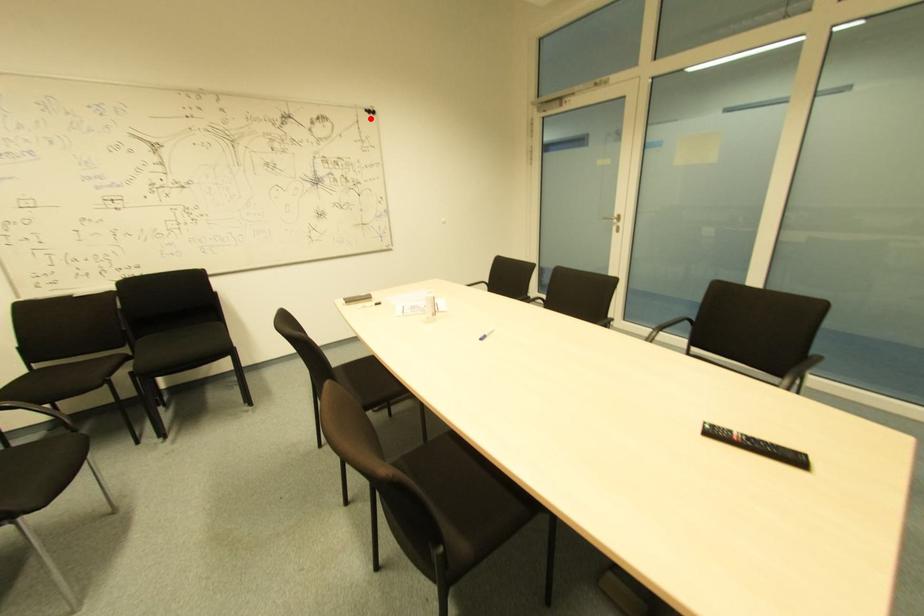
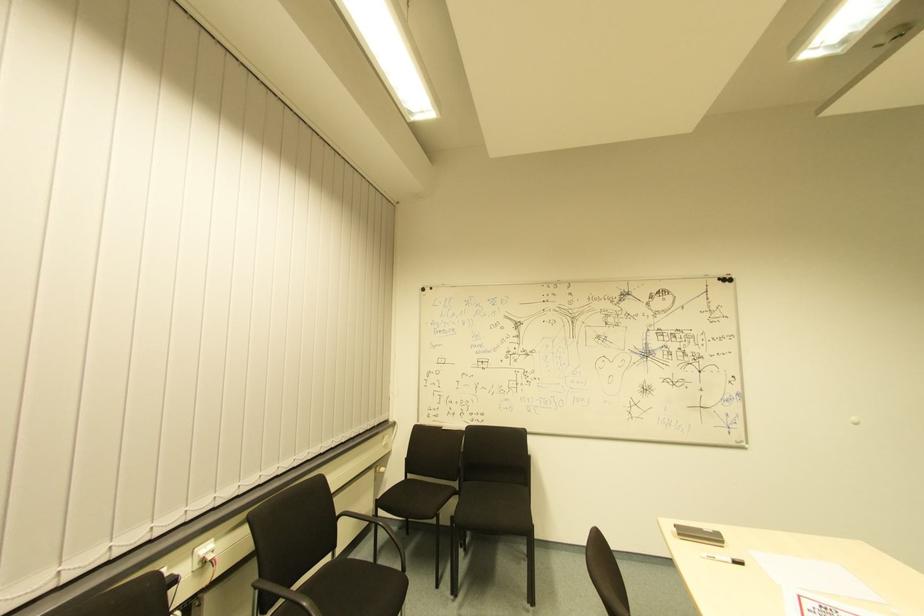
Find the pixel in the second image that matches the highlighted location in the first image.

(725, 286)